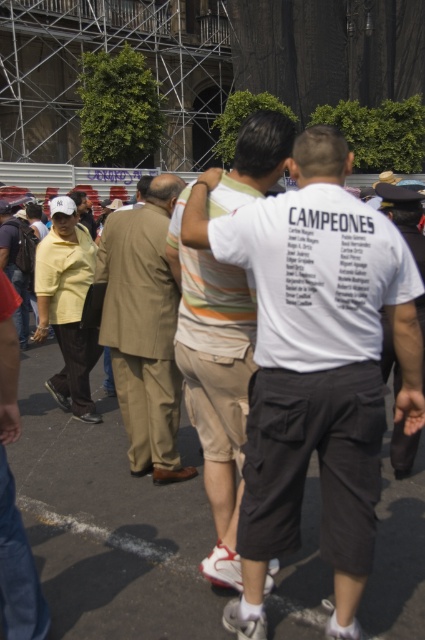
Can you confirm if white cotton shirt at center is positioned to the right of white cotton shirt at right?

No, white cotton shirt at center is not to the right of white cotton shirt at right.

Consider the image. Which is more to the left, white cotton shirt at center or white cotton shirt at right?

white cotton shirt at center is more to the left.

You are a GUI agent. You are given a task and a screenshot of the screen. Output one action in this format:
    pyautogui.click(x=<x>, y=<y>)
    Task: Click on the white cotton shirt at center
    The image size is (425, 640).
    Given the screenshot: What is the action you would take?
    pyautogui.click(x=215, y=378)

Does white cotton t-shirt at center have a lesser height compared to white cotton shirt at center?

Correct, white cotton t-shirt at center is not as tall as white cotton shirt at center.

In the scene shown: Is white cotton t-shirt at center bigger than white cotton shirt at center?

No.

This screenshot has height=640, width=425. What are the coordinates of `white cotton t-shirt at center` in the screenshot? It's located at (316, 365).

Does white cotton t-shirt at center have a lesser width compared to light brown suit at center?

In fact, white cotton t-shirt at center might be wider than light brown suit at center.

Which of these two, white cotton t-shirt at center or light brown suit at center, stands shorter?

With less height is light brown suit at center.

Locate an element on the screen. The image size is (425, 640). white cotton t-shirt at center is located at coordinates (316, 365).

Locate an element on the screen. Image resolution: width=425 pixels, height=640 pixels. white cotton t-shirt at center is located at coordinates (316, 365).